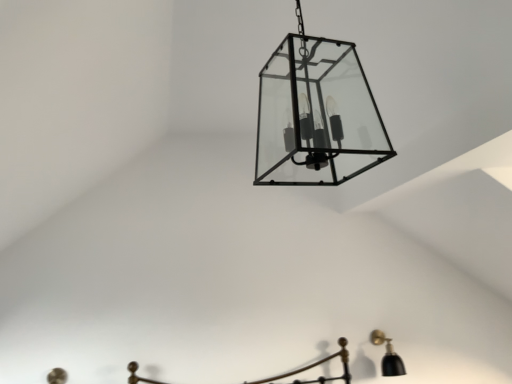
The width and height of the screenshot is (512, 384). What are the coordinates of `black matte wall sconce at lower right, which is the first lamp in back-to-front order` in the screenshot? It's located at tap(388, 355).

The image size is (512, 384). What do you see at coordinates (388, 355) in the screenshot? I see `black matte wall sconce at lower right, acting as the first lamp starting from the bottom` at bounding box center [388, 355].

Measure the distance between clear glass lantern at center, the second lamp from the bottom, and camera.

3.45 feet.

I want to click on clear glass lantern at center, acting as the first lamp starting from the front, so click(x=316, y=114).

What do you see at coordinates (316, 114) in the screenshot?
I see `clear glass lantern at center, the 2th lamp in the back-to-front sequence` at bounding box center [316, 114].

Locate an element on the screen. Image resolution: width=512 pixels, height=384 pixels. black matte wall sconce at lower right, which is the first lamp in back-to-front order is located at coordinates (388, 355).

Is black matte wall sconce at lower right, the 2th lamp from the top, at the right side of clear glass lantern at center, the 2th lamp in the back-to-front sequence?

Correct, you'll find black matte wall sconce at lower right, the 2th lamp from the top, to the right of clear glass lantern at center, the 2th lamp in the back-to-front sequence.

Does black matte wall sconce at lower right, the 2th lamp from the top, lie behind clear glass lantern at center, acting as the first lamp starting from the front?

Yes, it is behind clear glass lantern at center, acting as the first lamp starting from the front.

Is point (375, 341) farther from viewer compared to point (328, 51)?

Yes.

Consider the image. From the image's perspective, is black matte wall sconce at lower right, the second lamp viewed from the left, on top of clear glass lantern at center, which is counted as the 1th lamp, starting from the top?

Actually, black matte wall sconce at lower right, the second lamp viewed from the left, appears below clear glass lantern at center, which is counted as the 1th lamp, starting from the top, in the image.

From a real-world perspective, between black matte wall sconce at lower right, the second lamp viewed from the left, and clear glass lantern at center, the second lamp from the bottom, who is vertically lower?

black matte wall sconce at lower right, the second lamp viewed from the left.

Considering the sizes of objects black matte wall sconce at lower right, placed as the first lamp when sorted from right to left, and clear glass lantern at center, the 2th lamp in the back-to-front sequence, in the image provided, who is thinner, black matte wall sconce at lower right, placed as the first lamp when sorted from right to left, or clear glass lantern at center, the 2th lamp in the back-to-front sequence,?

black matte wall sconce at lower right, placed as the first lamp when sorted from right to left.

Which of these two, black matte wall sconce at lower right, the second lamp viewed from the left, or clear glass lantern at center, which is counted as the 1th lamp, starting from the top, stands shorter?

With less height is black matte wall sconce at lower right, the second lamp viewed from the left.

Between black matte wall sconce at lower right, the second lamp viewed from the front, and clear glass lantern at center, the second lamp from the bottom, which one has smaller size?

With smaller size is black matte wall sconce at lower right, the second lamp viewed from the front.

Choose the correct answer: Is black matte wall sconce at lower right, placed as the first lamp when sorted from right to left, inside clear glass lantern at center, the second lamp when ordered from right to left, or outside it?

black matte wall sconce at lower right, placed as the first lamp when sorted from right to left, is not enclosed by clear glass lantern at center, the second lamp when ordered from right to left.

Consider the image. Is black matte wall sconce at lower right, placed as the first lamp when sorted from right to left, not near clear glass lantern at center, the second lamp when ordered from right to left?

Yes.

Is black matte wall sconce at lower right, the second lamp viewed from the front, oriented towards clear glass lantern at center, the first lamp positioned from the left?

No.

Can you tell me how much black matte wall sconce at lower right, which is the first lamp in back-to-front order, and clear glass lantern at center, acting as the first lamp starting from the front, differ in facing direction?

0.000486 degrees separate the facing orientations of black matte wall sconce at lower right, which is the first lamp in back-to-front order, and clear glass lantern at center, acting as the first lamp starting from the front.

Measure the distance between black matte wall sconce at lower right, the second lamp viewed from the left, and clear glass lantern at center, acting as the first lamp starting from the front.

They are 1.79 meters apart.

What are the coordinates of `lamp in front of the black matte wall sconce at lower right, acting as the first lamp starting from the bottom` in the screenshot? It's located at (316, 114).

Is clear glass lantern at center, acting as the first lamp starting from the front, to the left of black matte wall sconce at lower right, the 2th lamp from the top, from the viewer's perspective?

Yes.

Looking at this image, is clear glass lantern at center, the second lamp when ordered from right to left, positioned behind black matte wall sconce at lower right, the 2th lamp from the top?

No.

Is point (315, 59) positioned after point (395, 362)?

No, it is not.

From the image's perspective, who appears lower, clear glass lantern at center, acting as the first lamp starting from the front, or black matte wall sconce at lower right, which is the first lamp in back-to-front order?

From the image's view, black matte wall sconce at lower right, which is the first lamp in back-to-front order, is below.

From a real-world perspective, is clear glass lantern at center, the second lamp from the bottom, physically below black matte wall sconce at lower right, the second lamp viewed from the left?

Incorrect, from a real-world perspective, clear glass lantern at center, the second lamp from the bottom, is higher than black matte wall sconce at lower right, the second lamp viewed from the left.

Which of these two, clear glass lantern at center, the second lamp when ordered from right to left, or black matte wall sconce at lower right, which is the first lamp in back-to-front order, is thinner?

black matte wall sconce at lower right, which is the first lamp in back-to-front order.

Considering the sizes of objects clear glass lantern at center, the 2th lamp in the back-to-front sequence, and black matte wall sconce at lower right, which is the first lamp in back-to-front order, in the image provided, who is shorter, clear glass lantern at center, the 2th lamp in the back-to-front sequence, or black matte wall sconce at lower right, which is the first lamp in back-to-front order,?

black matte wall sconce at lower right, which is the first lamp in back-to-front order, is shorter.

Can you confirm if clear glass lantern at center, the first lamp positioned from the left, is smaller than black matte wall sconce at lower right, the second lamp viewed from the front?

Incorrect, clear glass lantern at center, the first lamp positioned from the left, is not smaller in size than black matte wall sconce at lower right, the second lamp viewed from the front.

Is clear glass lantern at center, the 2th lamp in the back-to-front sequence, inside the boundaries of black matte wall sconce at lower right, the 2th lamp from the top, or outside?

clear glass lantern at center, the 2th lamp in the back-to-front sequence, is outside black matte wall sconce at lower right, the 2th lamp from the top.

Does clear glass lantern at center, the 2th lamp in the back-to-front sequence, touch black matte wall sconce at lower right, the 2th lamp from the top?

No, clear glass lantern at center, the 2th lamp in the back-to-front sequence, is not touching black matte wall sconce at lower right, the 2th lamp from the top.

Could you tell me if clear glass lantern at center, which is counted as the 1th lamp, starting from the top, is facing black matte wall sconce at lower right, which is the first lamp in back-to-front order?

No, clear glass lantern at center, which is counted as the 1th lamp, starting from the top, is not facing towards black matte wall sconce at lower right, which is the first lamp in back-to-front order.

How far apart are clear glass lantern at center, the second lamp when ordered from right to left, and black matte wall sconce at lower right, which is the first lamp in back-to-front order?

1.79 meters.

Where is `lamp on the right of the clear glass lantern at center, the first lamp positioned from the left`? lamp on the right of the clear glass lantern at center, the first lamp positioned from the left is located at coordinates (388, 355).

You are a GUI agent. You are given a task and a screenshot of the screen. Output one action in this format:
    pyautogui.click(x=<x>, y=<y>)
    Task: Click on the lamp lying on the left of black matte wall sconce at lower right, the 2th lamp from the top
    The width and height of the screenshot is (512, 384).
    Given the screenshot: What is the action you would take?
    [x=316, y=114]

Locate an element on the screen. This screenshot has width=512, height=384. lamp below the clear glass lantern at center, which is counted as the 1th lamp, starting from the top (from a real-world perspective) is located at coordinates (388, 355).